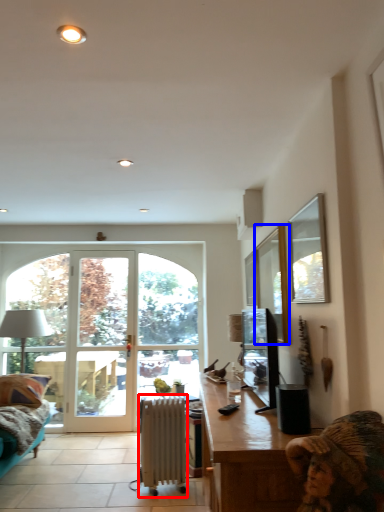
Question: Which object is further to the camera taking this photo, radiator (highlighted by a red box) or window (highlighted by a blue box)?

Choices:
 (A) radiator
 (B) window

Answer: (A)